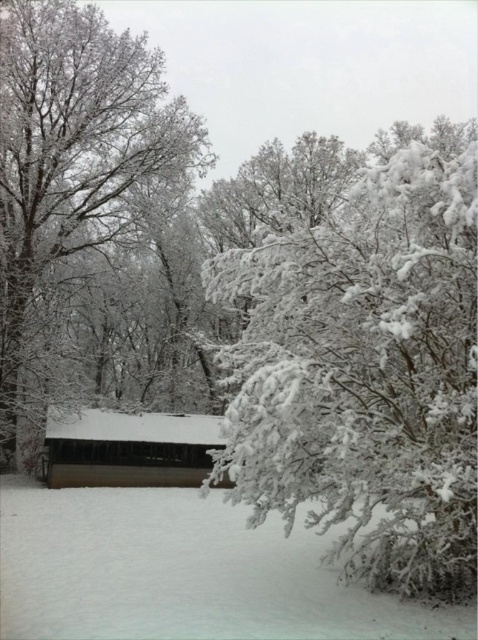
Between white frosty branches at center and white frosty tree at center, which one appears on the right side from the viewer's perspective?

From the viewer's perspective, white frosty branches at center appears more on the right side.

This screenshot has height=640, width=478. Describe the element at coordinates (366, 369) in the screenshot. I see `white frosty branches at center` at that location.

Where is `white frosty branches at center`? white frosty branches at center is located at coordinates (366, 369).

Is white fluffy snow at lower center to the right of white frosty tree at center from the viewer's perspective?

Indeed, white fluffy snow at lower center is positioned on the right side of white frosty tree at center.

Does white fluffy snow at lower center have a lesser height compared to white frosty tree at center?

Yes, white fluffy snow at lower center is shorter than white frosty tree at center.

Is point (162, 579) positioned in front of point (8, 310)?

That is True.

Image resolution: width=478 pixels, height=640 pixels. I want to click on white fluffy snow at lower center, so click(180, 572).

Is white frosty tree at center above wooden hut at center?

Yes.

Does point (108, 26) come farther from viewer compared to point (173, 413)?

Yes, point (108, 26) is behind point (173, 413).

Describe the element at coordinates (74, 152) in the screenshot. I see `white frosty tree at center` at that location.

You are a GUI agent. You are given a task and a screenshot of the screen. Output one action in this format:
    pyautogui.click(x=<x>, y=<y>)
    Task: Click on the white frosty tree at center
    This screenshot has height=640, width=478.
    Given the screenshot: What is the action you would take?
    click(x=74, y=152)